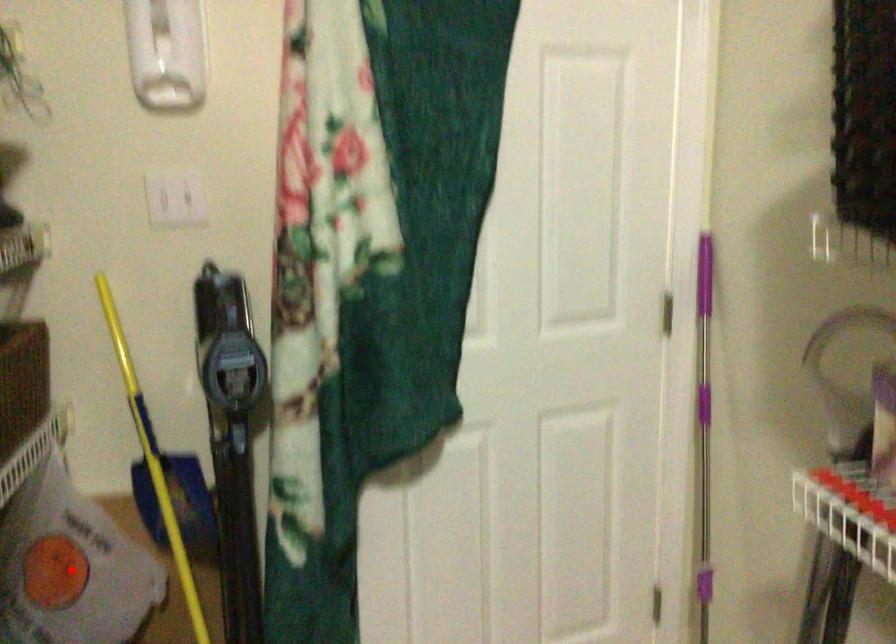
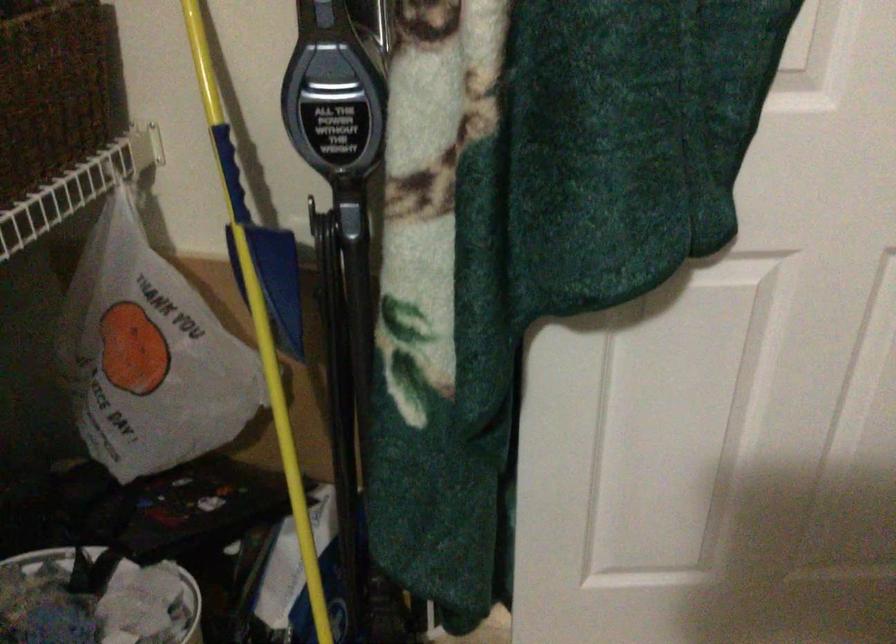
Question: I am providing you with two images of the same scene from different viewpoints. In image1, a red point is highlighted. Considering the same 3D point in image2, which of the following is correct?

Choices:
 (A) It is closer
 (B) It is farther

Answer: (A)